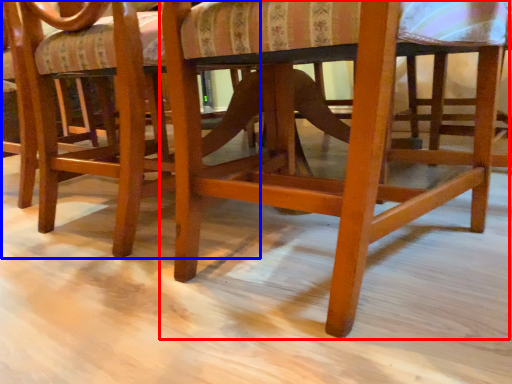
Question: Among these objects, which one is farthest to the camera, chair (highlighted by a red box) or chair (highlighted by a blue box)?

Choices:
 (A) chair
 (B) chair

Answer: (B)